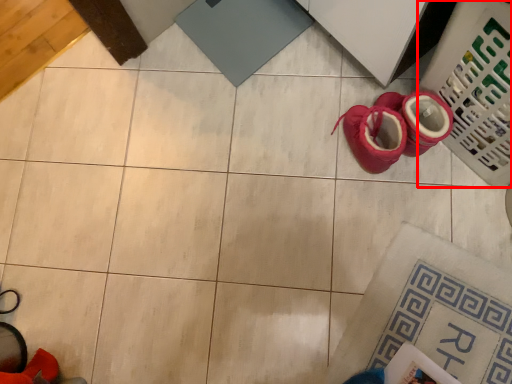
Question: Considering the relative positions of laundry basket (annotated by the red box) and footwear in the image provided, where is laundry basket (annotated by the red box) located with respect to the staircase?

Choices:
 (A) left
 (B) right

Answer: (B)